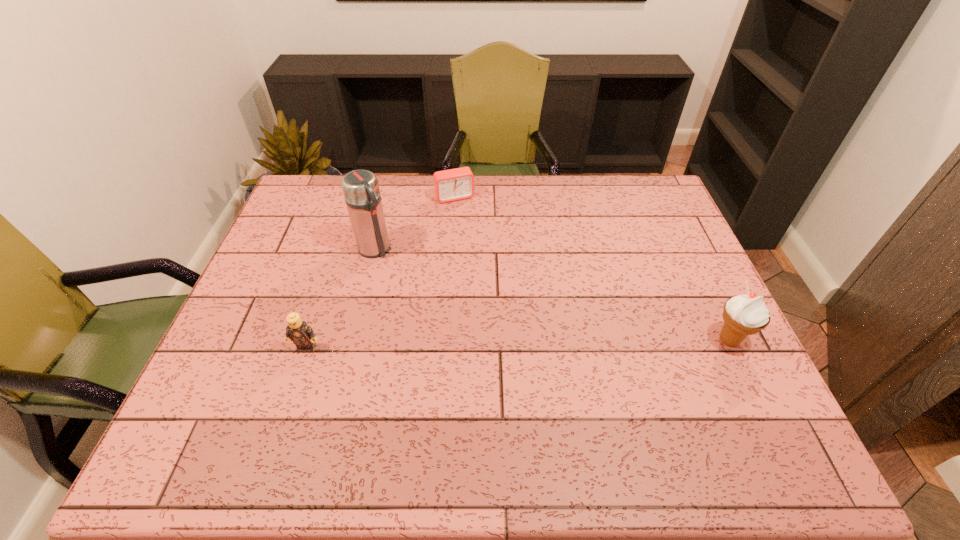
You are a GUI agent. You are given a task and a screenshot of the screen. Output one action in this format:
    pyautogui.click(x=<x>, y=<y>)
    Task: Click on the free space located with a handle on the side of the second object from left to right
    The width and height of the screenshot is (960, 540).
    Given the screenshot: What is the action you would take?
    pyautogui.click(x=457, y=335)

I want to click on vacant space positioned 0.390m with a handle on the side of the second object from left to right, so click(464, 342).

This screenshot has width=960, height=540. In order to click on vacant space located with a handle on the side of the second object from left to right in this screenshot , I will do `click(411, 287)`.

The image size is (960, 540). I want to click on vacant area located on the front-facing side of the farthest object, so click(491, 271).

The height and width of the screenshot is (540, 960). Identify the location of vacant region located 0.210m on the front-facing side of the farthest object. (478, 244).

I want to click on free space located 0.370m on the front-facing side of the farthest object, so click(x=495, y=280).

Where is `object present at the far edge`? The height and width of the screenshot is (540, 960). object present at the far edge is located at coordinates (450, 185).

At what (x,y) coordinates should I click in order to perform the action: click on object at the right edge. Please return your answer as a coordinate pair (x, y). Looking at the image, I should click on (743, 315).

In the image, there is a desktop. Identify the location of vacant space at the far edge. (418, 193).

The width and height of the screenshot is (960, 540). In the image, there is a desktop. What are the coordinates of `free space at the near edge` in the screenshot? It's located at (376, 394).